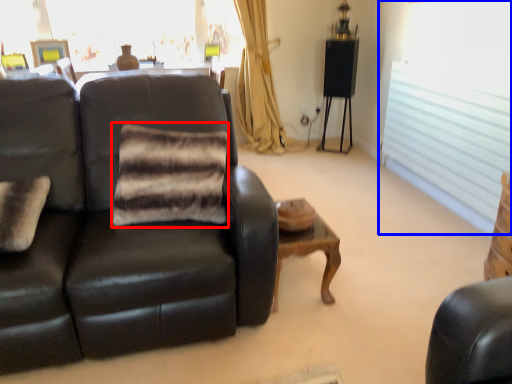
Question: Which object is further to the camera taking this photo, pillow (highlighted by a red box) or window (highlighted by a blue box)?

Choices:
 (A) pillow
 (B) window

Answer: (B)